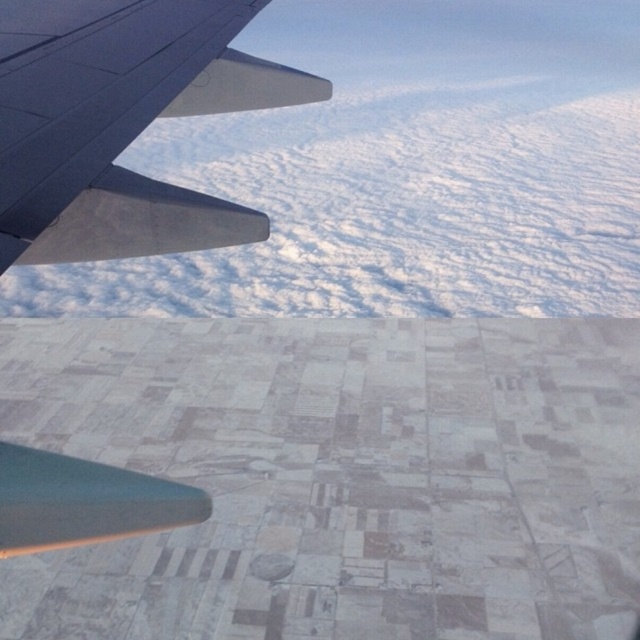
Which is in front, point (307, 225) or point (208, 81)?

Point (208, 81) is more forward.

Who is positioned more to the left, white fluffy cloud at upper center or metallic gray wing at upper left?

From the viewer's perspective, metallic gray wing at upper left appears more on the left side.

Where is `white fluffy cloud at upper center`? white fluffy cloud at upper center is located at coordinates (403, 172).

Locate an element on the screen. white fluffy cloud at upper center is located at coordinates (403, 172).